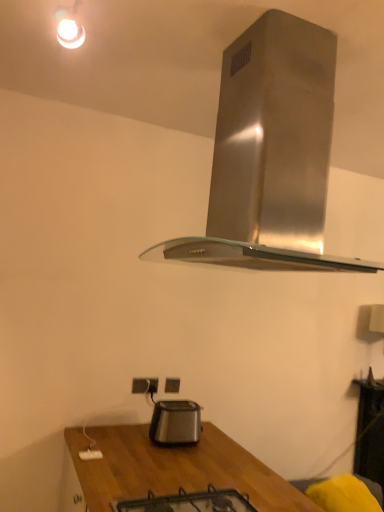
Question: From a real-world perspective, is satin black toaster at lower center physically below stainless steel range hood at upper center?

Choices:
 (A) no
 (B) yes

Answer: (B)

Question: Does satin black toaster at lower center come behind stainless steel range hood at upper center?

Choices:
 (A) no
 (B) yes

Answer: (B)

Question: From a real-world perspective, is satin black toaster at lower center located higher than stainless steel range hood at upper center?

Choices:
 (A) yes
 (B) no

Answer: (B)

Question: Could you tell me if satin black toaster at lower center is turned towards stainless steel range hood at upper center?

Choices:
 (A) yes
 (B) no

Answer: (B)

Question: Considering the relative sizes of satin black toaster at lower center and stainless steel range hood at upper center in the image provided, is satin black toaster at lower center thinner than stainless steel range hood at upper center?

Choices:
 (A) no
 (B) yes

Answer: (B)

Question: Relative to stainless steel range hood at upper center, is satin black toaster at lower center in front or behind?

Choices:
 (A) behind
 (B) front

Answer: (A)

Question: Based on their sizes in the image, would you say satin black toaster at lower center is bigger or smaller than stainless steel range hood at upper center?

Choices:
 (A) small
 (B) big

Answer: (A)

Question: Does point (155, 410) appear closer or farther from the camera than point (240, 122)?

Choices:
 (A) farther
 (B) closer

Answer: (A)

Question: Considering the relative positions of satin black toaster at lower center and stainless steel range hood at upper center in the image provided, is satin black toaster at lower center to the left or to the right of stainless steel range hood at upper center?

Choices:
 (A) left
 (B) right

Answer: (A)

Question: Considering the relative positions of stainless steel range hood at upper center and black glass gas stove at lower center in the image provided, is stainless steel range hood at upper center to the left or to the right of black glass gas stove at lower center?

Choices:
 (A) right
 (B) left

Answer: (A)

Question: Does point (309, 40) appear closer or farther from the camera than point (203, 510)?

Choices:
 (A) closer
 (B) farther

Answer: (A)

Question: Which is correct: stainless steel range hood at upper center is inside black glass gas stove at lower center, or outside of it?

Choices:
 (A) outside
 (B) inside

Answer: (A)

Question: Looking at their shapes, would you say stainless steel range hood at upper center is wider or thinner than black glass gas stove at lower center?

Choices:
 (A) wide
 (B) thin

Answer: (A)

Question: Choose the correct answer: Is black glass gas stove at lower center inside stainless steel range hood at upper center or outside it?

Choices:
 (A) inside
 (B) outside

Answer: (B)

Question: Does point (231, 503) appear closer or farther from the camera than point (256, 134)?

Choices:
 (A) closer
 (B) farther

Answer: (B)